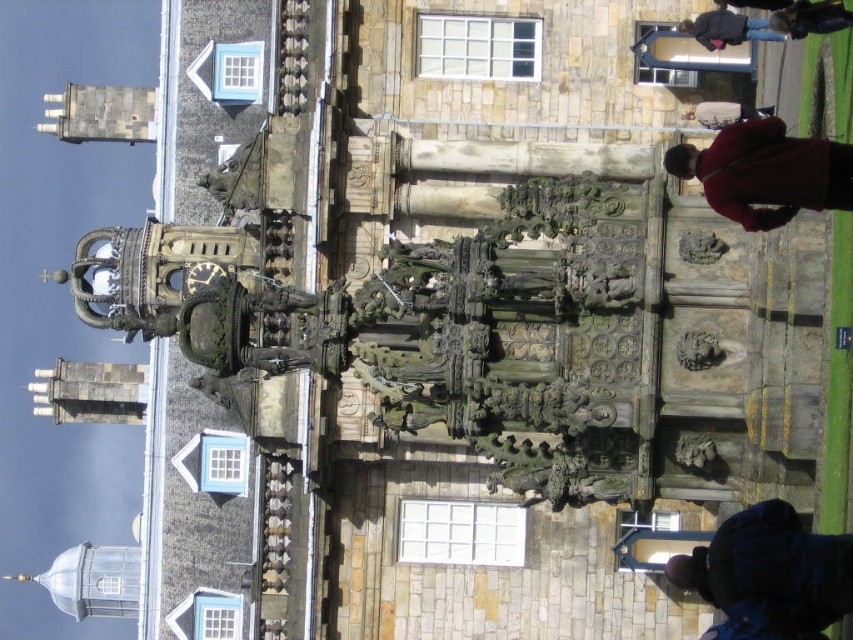
Question: Which of these objects is positioned closest to the dark brown leather jacket at upper right?

Choices:
 (A) dark blue jacket at lower right
 (B) dark blue jacket at upper right
 (C) red woolen sweater at upper right

Answer: (B)

Question: Can you confirm if dark blue jacket at lower right is wider than dark blue jacket at upper right?

Choices:
 (A) yes
 (B) no

Answer: (A)

Question: Which point is farther from the camera taking this photo?

Choices:
 (A) (711, 17)
 (B) (721, 122)

Answer: (B)

Question: Which object appears closest to the camera in this image?

Choices:
 (A) red woolen sweater at upper right
 (B) matte brown coat at upper right

Answer: (A)

Question: Can you confirm if dark blue jacket at lower right is smaller than red woolen sweater at upper right?

Choices:
 (A) no
 (B) yes

Answer: (A)

Question: Is red woolen sweater at upper right further to camera compared to dark blue jacket at upper right?

Choices:
 (A) yes
 (B) no

Answer: (B)